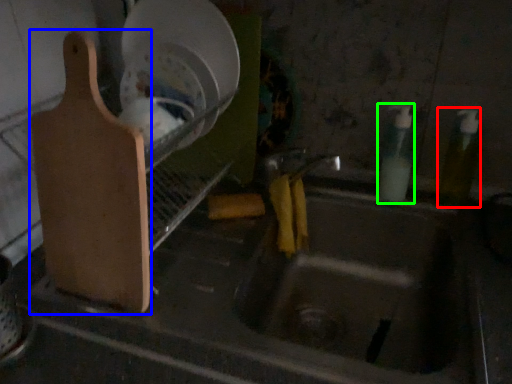
Question: Estimate the real-world distances between objects in this image. Which object is farther from bottle (highlighted by a red box), cutting board (highlighted by a blue box) or bottle (highlighted by a green box)?

Choices:
 (A) cutting board
 (B) bottle

Answer: (A)